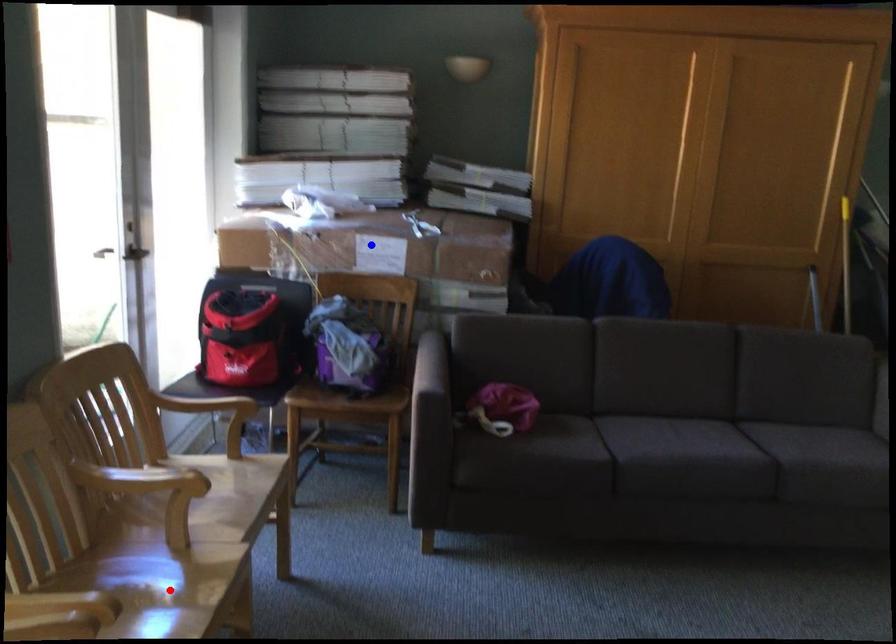
Question: In the image, two points are highlighted. Which point is nearer to the camera? Reply with the corresponding letter.

Choices:
 (A) blue point
 (B) red point

Answer: (B)